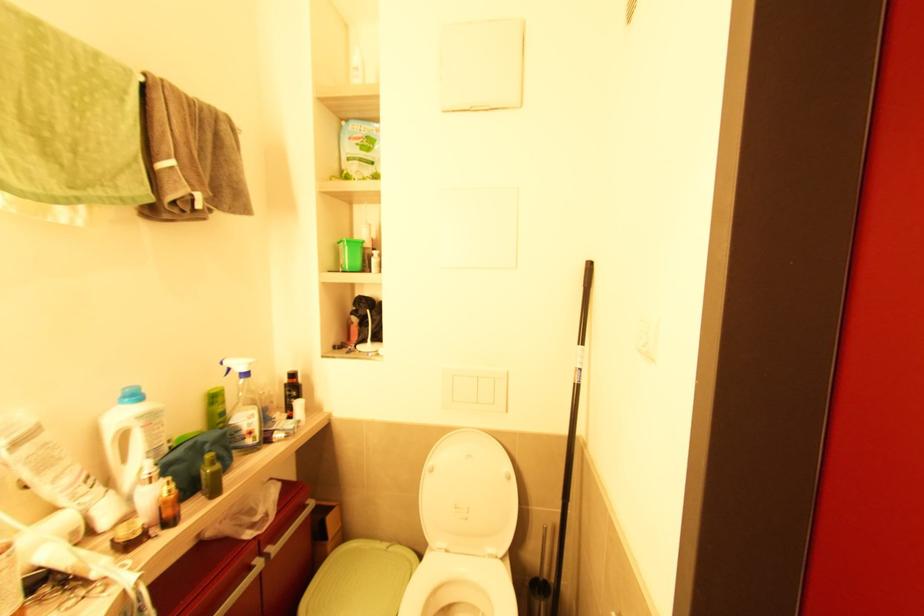
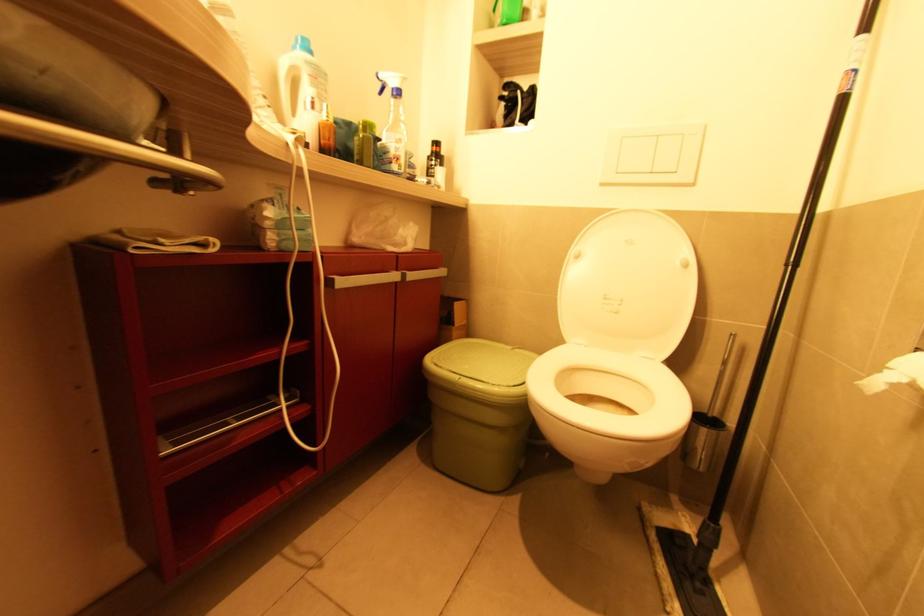
In a continuous first-person perspective shot, in which direction is the camera moving?

The cameraman moved toward left, forward.